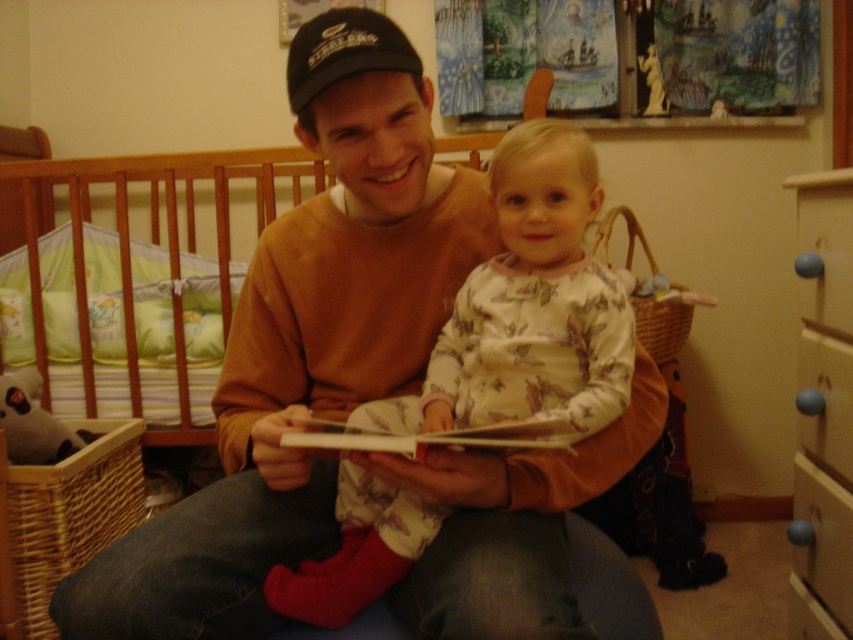
Can you confirm if blue plastic drawer at lower right is thinner than black fabric baseball cap at upper center?

Correct, blue plastic drawer at lower right's width is less than black fabric baseball cap at upper center's.

Where is `blue plastic drawer at lower right`? This screenshot has width=853, height=640. blue plastic drawer at lower right is located at coordinates (819, 554).

Does matte orange sweater at center have a larger size compared to green fabric crib at left?

Incorrect, matte orange sweater at center is not larger than green fabric crib at left.

Does matte orange sweater at center have a greater width compared to green fabric crib at left?

No.

Between point (276, 225) and point (36, 241), which one is positioned behind?

The point (36, 241) is more distant.

At what (x,y) coordinates should I click in order to perform the action: click on matte orange sweater at center. Please return your answer as a coordinate pair (x, y). The height and width of the screenshot is (640, 853). Looking at the image, I should click on (300, 369).

Which is more to the left, fluffy white onesie at center or green fabric crib at left?

green fabric crib at left is more to the left.

Between fluffy white onesie at center and green fabric crib at left, which one appears on the right side from the viewer's perspective?

Positioned to the right is fluffy white onesie at center.

The image size is (853, 640). Describe the element at coordinates (529, 307) in the screenshot. I see `fluffy white onesie at center` at that location.

Find the location of a particular element. fluffy white onesie at center is located at coordinates (529, 307).